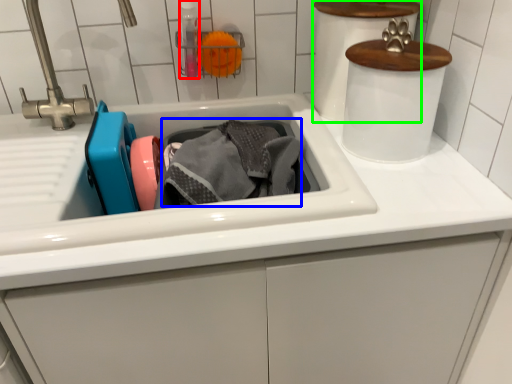
Question: Which object is the closest to the bottle (highlighted by a red box)? Choose among these: material (highlighted by a blue box) or appliance (highlighted by a green box).

Choices:
 (A) material
 (B) appliance

Answer: (A)